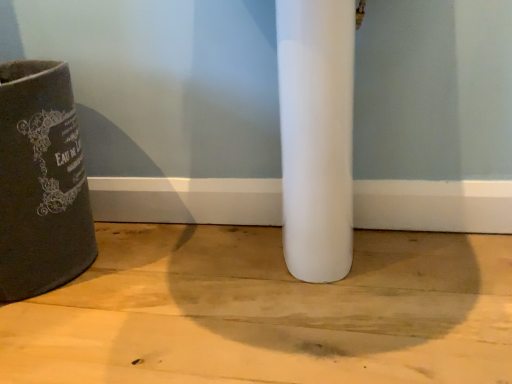
Question: Considering the relative positions of white matte concrete at center and dark gray fabric waste container at left in the image provided, is white matte concrete at center to the left or to the right of dark gray fabric waste container at left?

Choices:
 (A) left
 (B) right

Answer: (B)

Question: Choose the correct answer: Is white matte concrete at center inside dark gray fabric waste container at left or outside it?

Choices:
 (A) inside
 (B) outside

Answer: (B)

Question: In terms of height, does white matte concrete at center look taller or shorter compared to dark gray fabric waste container at left?

Choices:
 (A) tall
 (B) short

Answer: (B)

Question: Do you think dark gray fabric waste container at left is within white matte concrete at center, or outside of it?

Choices:
 (A) outside
 (B) inside

Answer: (A)

Question: Is dark gray fabric waste container at left in front of or behind white matte concrete at center in the image?

Choices:
 (A) behind
 (B) front

Answer: (A)

Question: Considering the positions of dark gray fabric waste container at left and white matte concrete at center in the image, is dark gray fabric waste container at left taller or shorter than white matte concrete at center?

Choices:
 (A) short
 (B) tall

Answer: (B)

Question: Is dark gray fabric waste container at left wider or thinner than white matte concrete at center?

Choices:
 (A) wide
 (B) thin

Answer: (B)